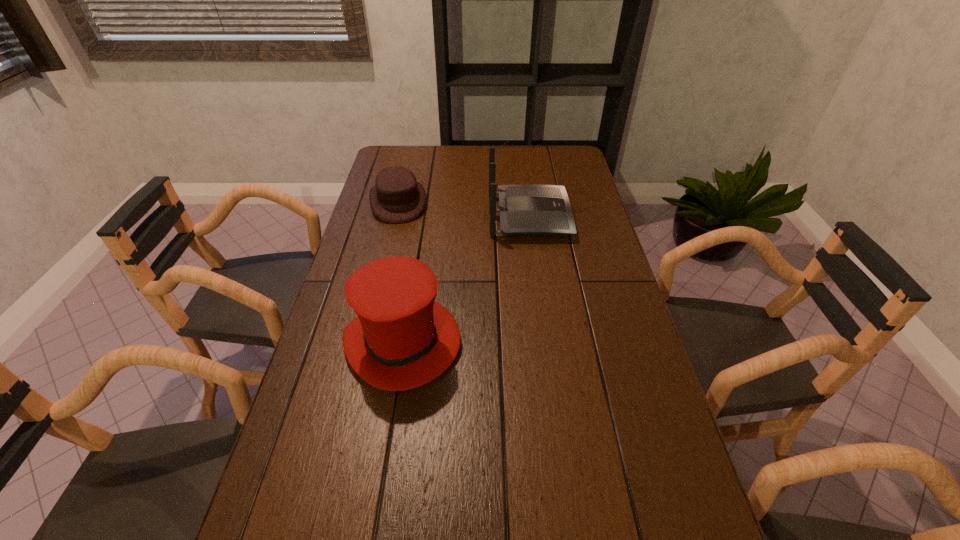
This screenshot has width=960, height=540. In the image, there is a desktop. What are the coordinates of `free space at the left edge` in the screenshot? It's located at (337, 394).

In the image, there is a desktop. Where is `free space at the right edge`? The image size is (960, 540). free space at the right edge is located at coordinates click(x=600, y=324).

Where is `vacant area at the far right corner`? This screenshot has width=960, height=540. vacant area at the far right corner is located at coordinates (546, 166).

At what (x,y) coordinates should I click in order to perform the action: click on empty space between the shortest object and the router. Please return your answer as a coordinate pair (x, y). This screenshot has width=960, height=540. Looking at the image, I should click on (x=464, y=209).

Locate an element on the screen. This screenshot has width=960, height=540. vacant point located between the taller hat and the router is located at coordinates (466, 279).

Find the location of `free spot between the rightmost object and the nearer hat`. free spot between the rightmost object and the nearer hat is located at coordinates (466, 279).

In order to click on vacant area between the shortest object and the rightmost object in this screenshot , I will do `click(464, 209)`.

I want to click on free point between the farther hat and the rightmost object, so click(464, 209).

You are a GUI agent. You are given a task and a screenshot of the screen. Output one action in this format:
    pyautogui.click(x=<x>, y=<y>)
    Task: Click on the object that stands as the closest to the nearer hat
    This screenshot has height=540, width=960.
    Given the screenshot: What is the action you would take?
    pyautogui.click(x=527, y=209)

Locate an element on the screen. object that is the closest one to the rightmost object is located at coordinates point(396,198).